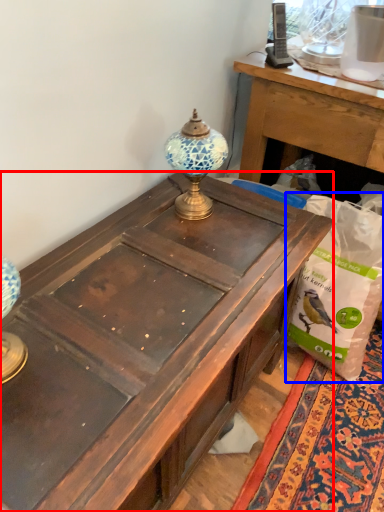
Question: Which object is further to the camera taking this photo, desk (highlighted by a red box) or paper bag (highlighted by a blue box)?

Choices:
 (A) desk
 (B) paper bag

Answer: (B)